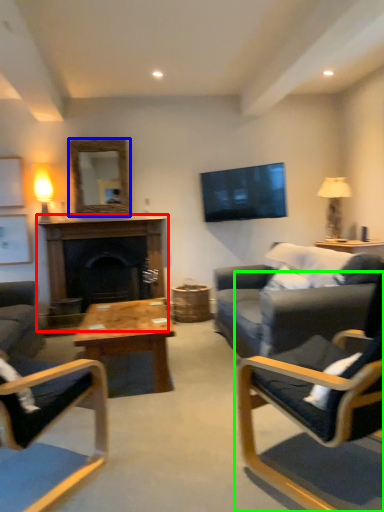
Question: Estimate the real-world distances between objects in this image. Which object is closer to fireplace (highlighted by a red box), mirror (highlighted by a blue box) or chair (highlighted by a green box)?

Choices:
 (A) mirror
 (B) chair

Answer: (A)